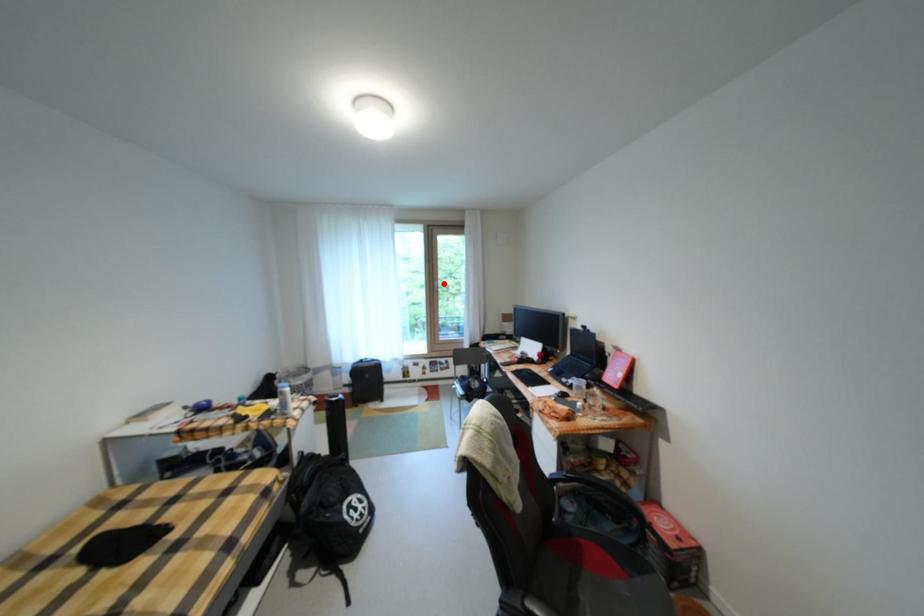
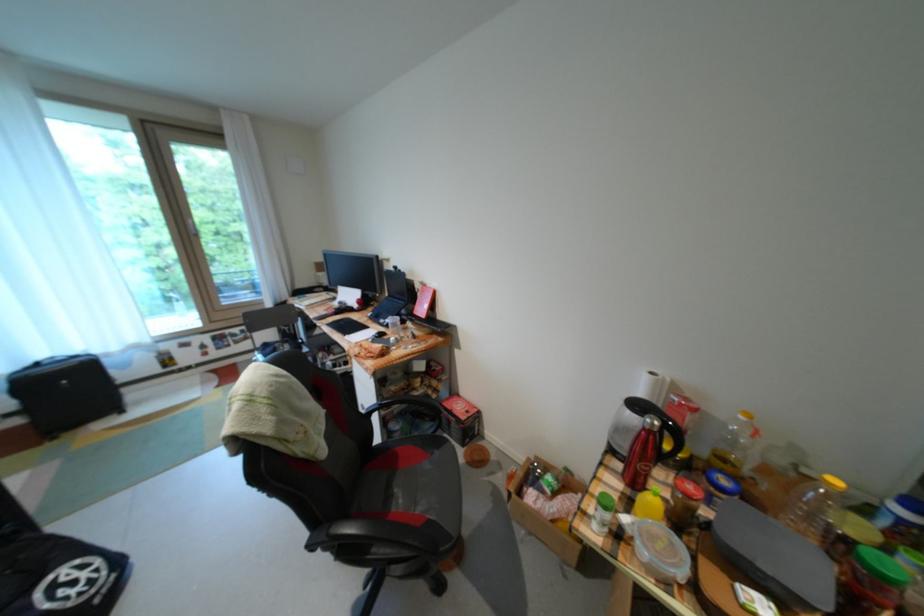
The point at the highlighted location is marked in the first image. Where is the corresponding point in the second image?

(195, 223)